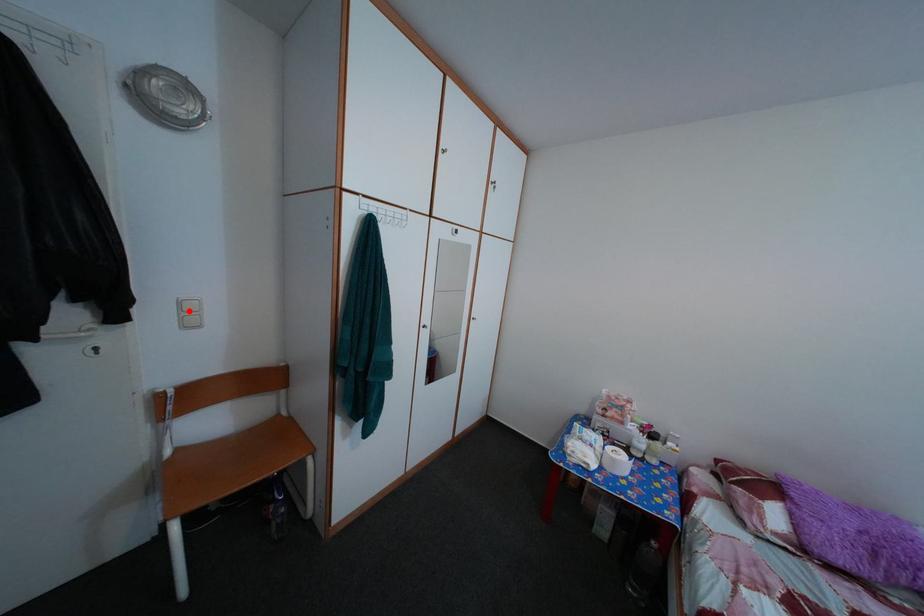
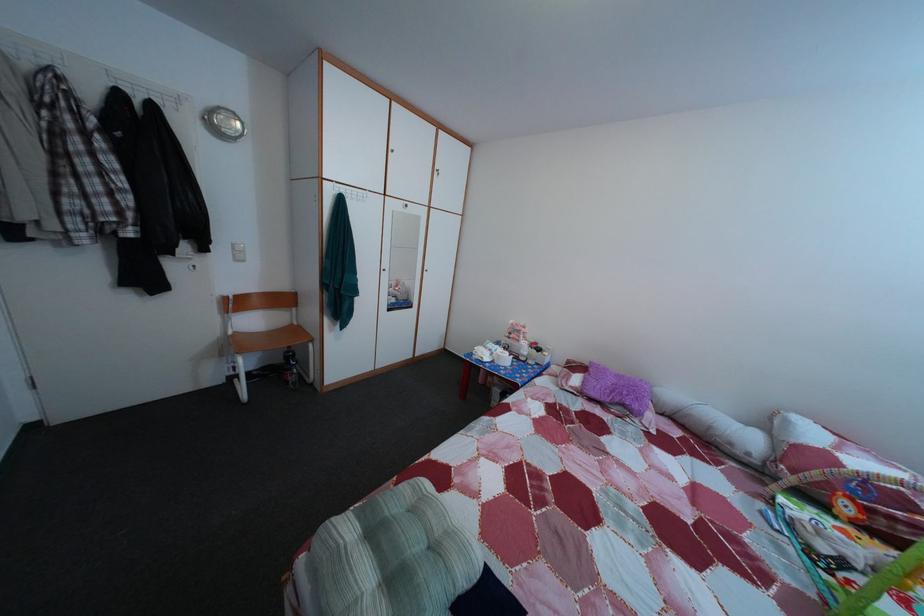
Question: I am providing you with two images of the same scene from different viewpoints. Given a red point in image1, look at the same physical point in image2. Is it:

Choices:
 (A) Closer to the viewpoint
 (B) Farther from the viewpoint

Answer: (A)